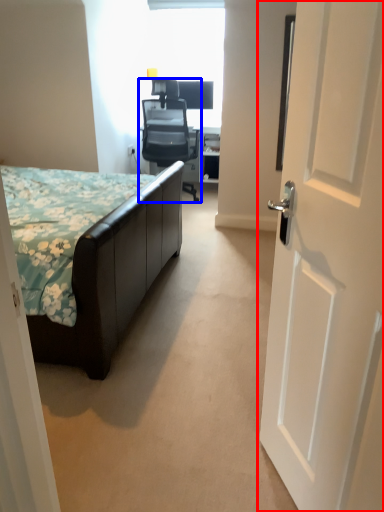
Question: Which object is closer to the camera taking this photo, door (highlighted by a red box) or chair (highlighted by a blue box)?

Choices:
 (A) door
 (B) chair

Answer: (A)